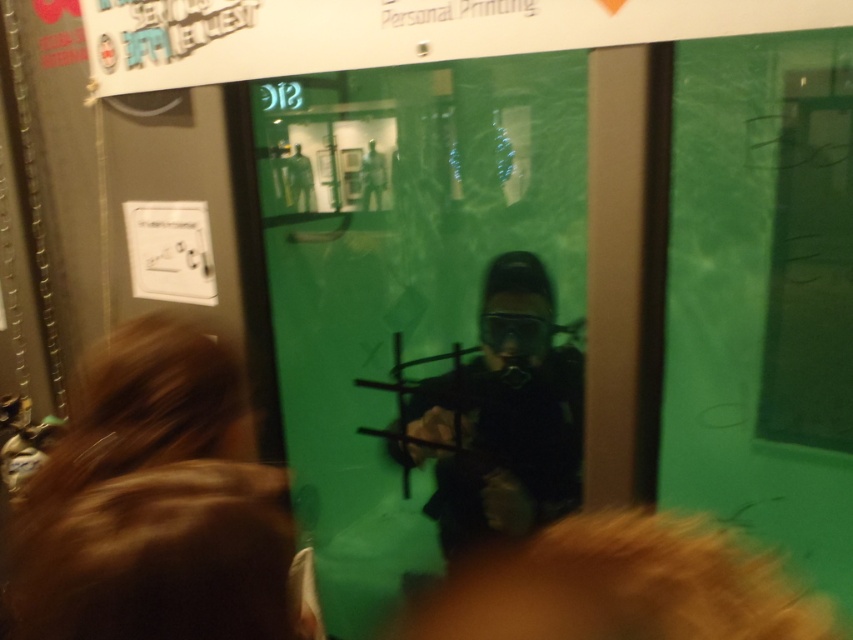
In the scene shown: You are an interior designer assessing a building entrance. You see the green matte glass door at center and the black matte diving suit at center. Which object is taller?

The green matte glass door at center is taller than the black matte diving suit at center.

You are standing in a room with a green matte glass door at center. If you want to locate the door precisely, what are its coordinates?

The green matte glass door at center is located at coordinates point (425, 308).

You are standing in front of a green matte glass door at center and a black matte diving suit at center. Which object is positioned higher in the scene?

The green matte glass door at center is located above the black matte diving suit at center, so it is positioned higher in the scene.